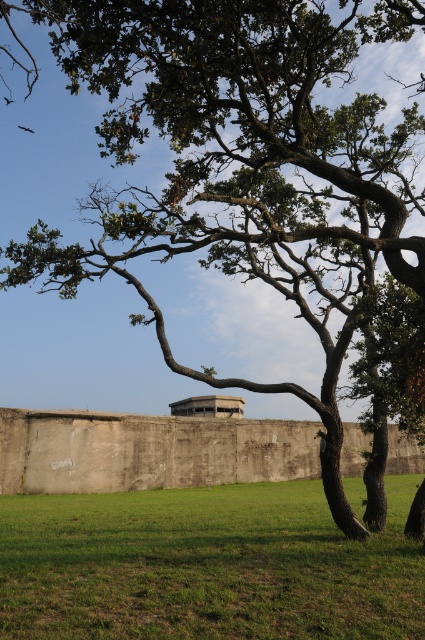
You are standing in the outdoor scene and want to walk towards the green grass at center. Based on the image, will you need to step over the concrete wall at center to reach it?

The green grass at center is positioned over the concrete wall at center, so you would need to step over the concrete wall at center to reach the green grass at center.

You are standing at the origin point of the coordinate system in the image. You want to walk to the green grass at center. Which direction should you move in terms of x and y coordinates?

The green grass at center is located at coordinates x 0.886 and y 0.485, so you should move in the positive x and positive y directions to reach it.

Consider the image. You are a gardener planning to plant flowers in the green grass at center. Considering the space available, can you fit a row of flowers that requires 2 meters of width? Please refer to the concrete wall at center for spatial context.

The green grass at center has a lesser width compared to the concrete wall at center. Since the grass area is narrower than the wall, it might not accommodate a 2m wide flower row. Check the grass width first.